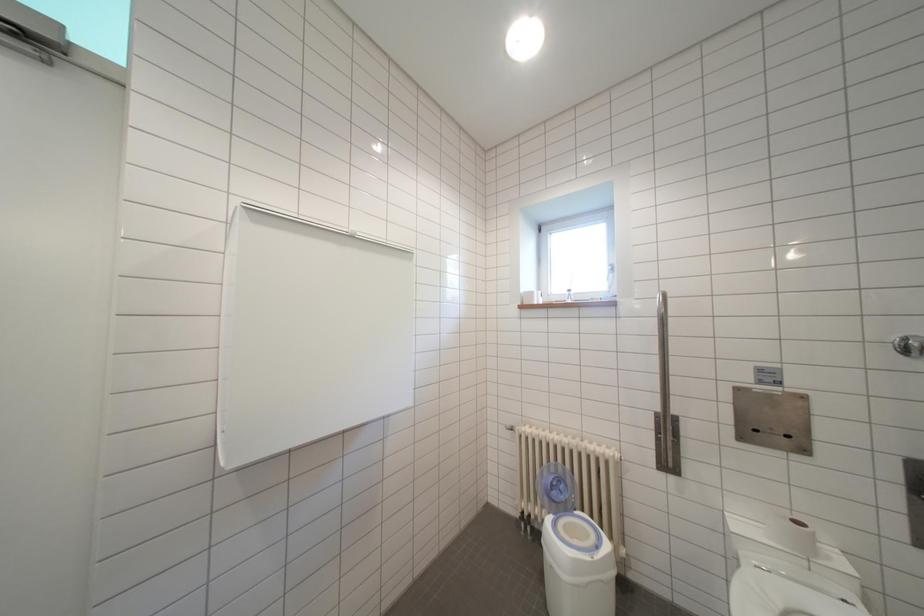
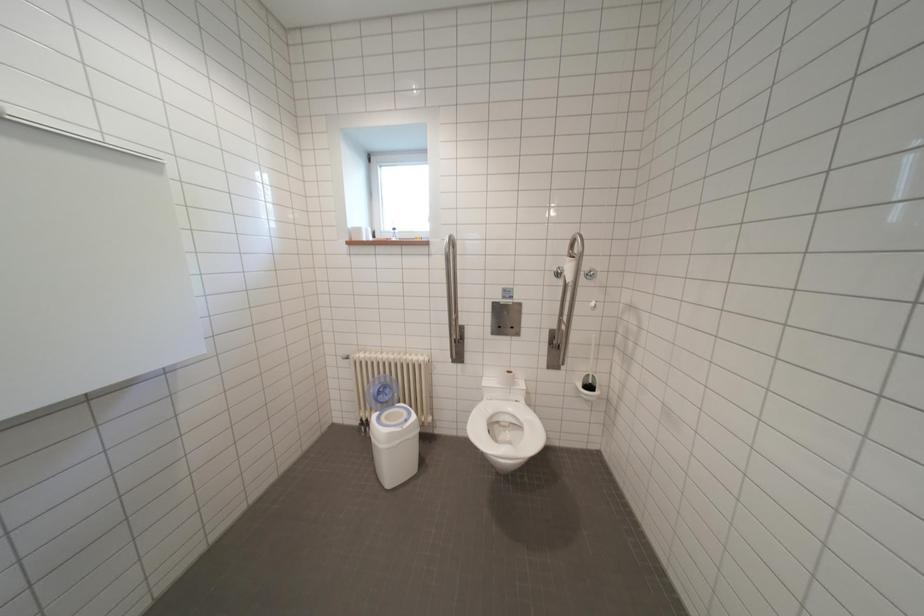
Question: The first image is from the beginning of the video and the second image is from the end. How did the camera likely rotate when shooting the video?

Choices:
 (A) Left
 (B) Right
 (C) Up
 (D) Down

Answer: (B)